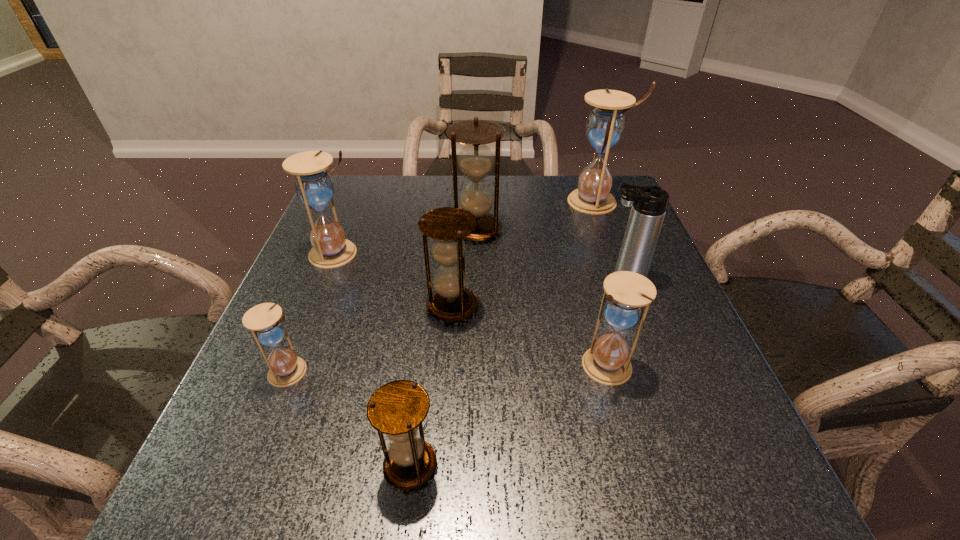
The height and width of the screenshot is (540, 960). In order to click on the nearest object in this screenshot , I will do `click(397, 409)`.

Where is `vacant space situated 0.150m on the left of the farthest object`? vacant space situated 0.150m on the left of the farthest object is located at coordinates (514, 201).

The width and height of the screenshot is (960, 540). In order to click on blank area located on the left of the farthest brown hourglass in this screenshot , I will do `click(324, 230)`.

Where is `blank space located on the back of the third nearest white hourglass`? blank space located on the back of the third nearest white hourglass is located at coordinates (364, 185).

The height and width of the screenshot is (540, 960). In order to click on vacant space positioned on the handle side of the thermos bottle in this screenshot , I will do `click(576, 279)`.

You are a GUI agent. You are given a task and a screenshot of the screen. Output one action in this format:
    pyautogui.click(x=<x>, y=<y>)
    Task: Click on the free space located 0.360m on the handle side of the thermos bottle
    
    Given the screenshot: What is the action you would take?
    pyautogui.click(x=437, y=279)

The height and width of the screenshot is (540, 960). What are the coordinates of `free space located on the handle side of the thermos bottle` in the screenshot? It's located at (459, 279).

The image size is (960, 540). What are the coordinates of `free spot located 0.330m on the right of the second farthest brown hourglass` in the screenshot? It's located at (637, 306).

Where is `vacant point located on the left of the second smallest white hourglass`? vacant point located on the left of the second smallest white hourglass is located at coordinates (504, 366).

Identify the location of free spot located 0.150m on the front of the smallest white hourglass. The width and height of the screenshot is (960, 540). (251, 472).